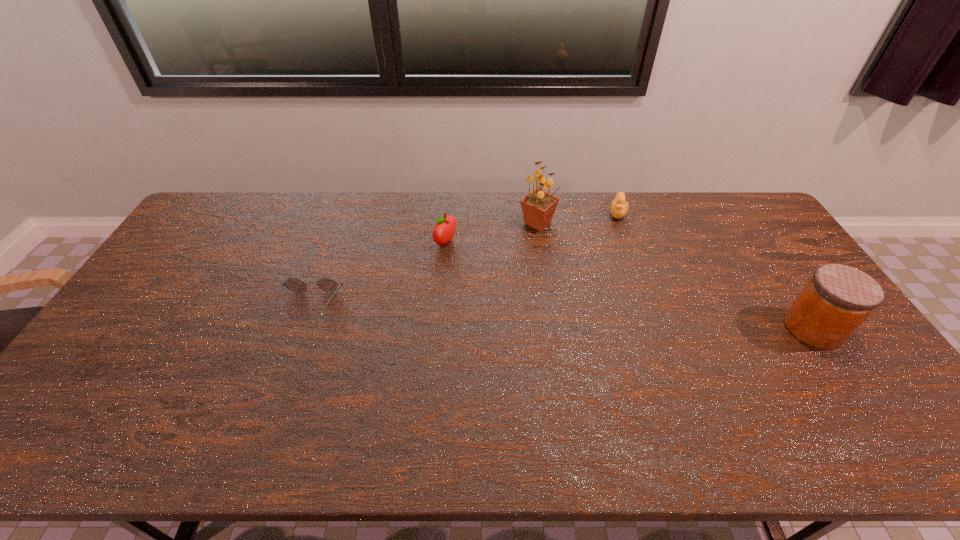
Identify the location of spectacles. (329, 285).

Find the location of a particular element. Image resolution: width=960 pixels, height=540 pixels. the shortest object is located at coordinates (329, 285).

Find the location of a particular element. Image resolution: width=960 pixels, height=540 pixels. the fourth shortest object is located at coordinates (837, 299).

Identify the location of jar. The height and width of the screenshot is (540, 960). coord(837,299).

Locate an element on the screen. This screenshot has width=960, height=540. the fourth tallest object is located at coordinates pyautogui.click(x=619, y=207).

Image resolution: width=960 pixels, height=540 pixels. Identify the location of the second object from right to left. (619, 207).

Identify the location of the third tallest object. The width and height of the screenshot is (960, 540). (444, 231).

The width and height of the screenshot is (960, 540). I want to click on apple, so click(x=444, y=231).

The width and height of the screenshot is (960, 540). I want to click on the third object from right to left, so click(x=538, y=207).

Locate an element on the screen. This screenshot has height=540, width=960. sunflower is located at coordinates (538, 207).